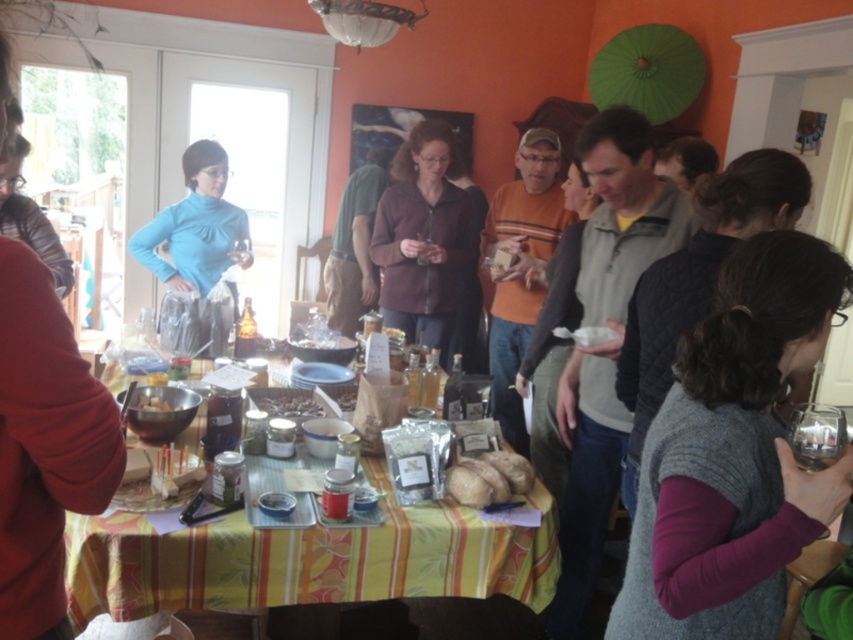
You are a photographer who needs to capture a closeup of the yellow striped tablecloth at center for a food blog. Your camera has a minimum focusing distance of 5 feet. Can you take the photo without moving the camera or the tablecloth?

The yellow striped tablecloth at center and camera are 5.33 feet apart. Since the minimum focusing distance is 5 feet, the photographer can take the closeup without moving either because the distance is sufficient.

You are a guest at this event and want to place a small item on the table. You notice the gray knitted vest at lower right and the matte brown bowl at center. Which object should you avoid placing the item on top of to ensure it doesn not fall off?

You should avoid placing the item on the matte brown bowl at center because it is shorter than the gray knitted vest at lower right, making it more likely for the item to fall off.

You are at the gathering and want to place a small jar of jam on the table. Where should you put it so it doesn not block the matte brown sweater at center?

The matte brown sweater at center is located at point [422,237]. To avoid blocking it, place the jar somewhere else on the table away from that coordinate.